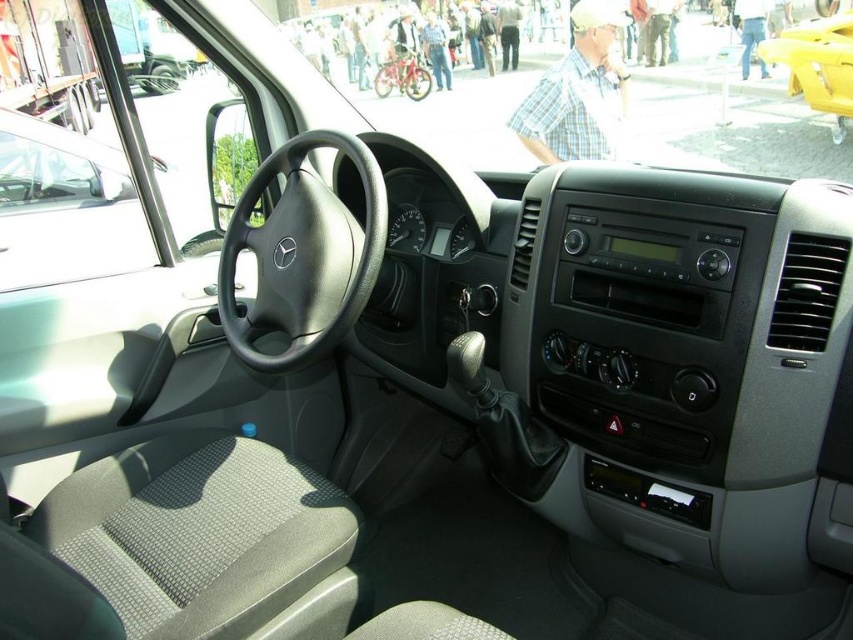
Question: Which of the following is the closest to the observer?

Choices:
 (A) black leather steering wheel at center
 (B) metallic red bicycle at center

Answer: (A)

Question: Which object is farther from the camera taking this photo?

Choices:
 (A) black leather steering wheel at center
 (B) metallic red bicycle at center

Answer: (B)

Question: Can you confirm if black leather steering wheel at center is positioned to the right of metallic red bicycle at center?

Choices:
 (A) no
 (B) yes

Answer: (B)

Question: Can you confirm if black leather steering wheel at center is positioned to the right of metallic red bicycle at center?

Choices:
 (A) no
 (B) yes

Answer: (B)

Question: Can you confirm if black leather steering wheel at center is thinner than metallic red bicycle at center?

Choices:
 (A) yes
 (B) no

Answer: (A)